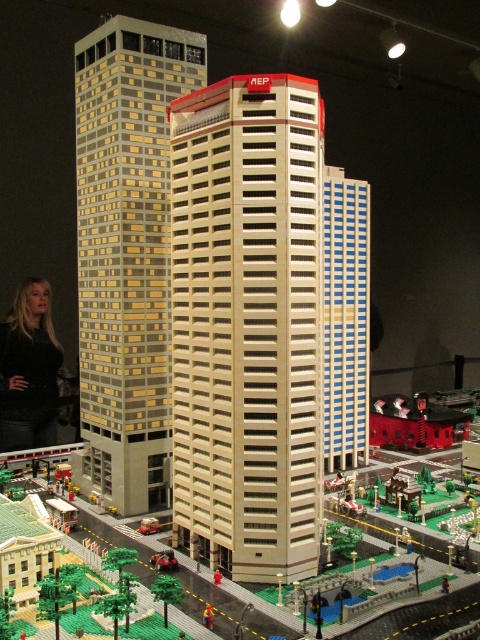
You are a Lego figure standing on the ground in the Lego city. You see the beige brick building at center and the black sweater at lower left. Which object is positioned to the right of the other?

The beige brick building at center is positioned to the right of the black sweater at lower left.

You are navigating a Lego city and need to locate the matte gold brick building at center. According to the coordinates provided, where exactly is it positioned?

The matte gold brick building at center is located at point coordinates of [127,253].

You are a Lego enthusiast trying to place a new Lego figure between the matte gold brick building at center and the black sweater at lower left. Can you fit the figure there if the figure requires 10 cm of space?

The matte gold brick building at center might be wider than black sweater at lower left, but since the exact width difference isn not specified, it is uncertain whether there is enough space for the 10 cm required by the Lego figure. Check the actual distance before placing the figure.